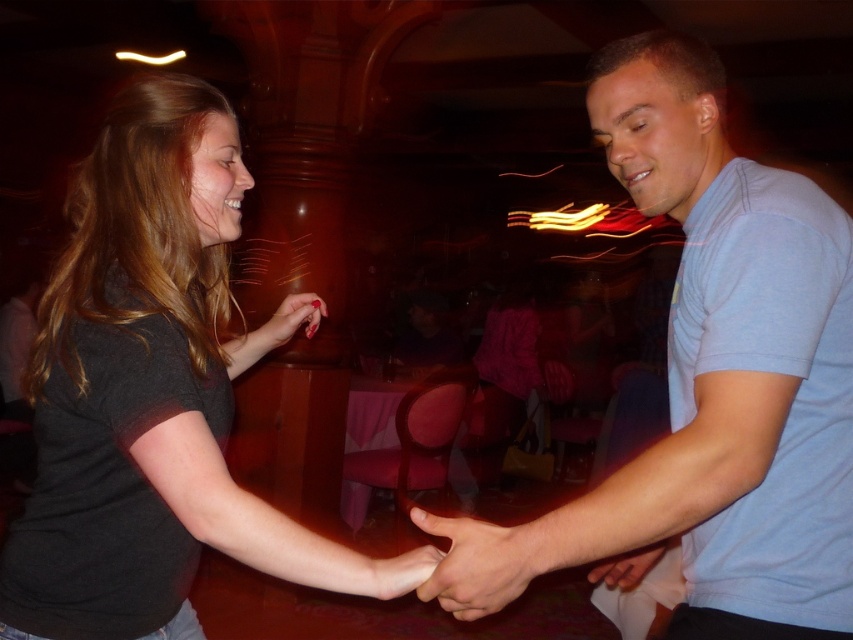
Between light blue cotton shirt at center and smooth red nail polish at center, which one has less height?

smooth red nail polish at center is shorter.

Who is more distant from viewer, (769, 326) or (312, 308)?

The point (312, 308) is behind.

Find the location of a particular element. The height and width of the screenshot is (640, 853). light blue cotton shirt at center is located at coordinates pyautogui.click(x=709, y=384).

The width and height of the screenshot is (853, 640). Identify the location of light blue cotton shirt at center. (709, 384).

Is point (546, 534) more distant than point (289, 328)?

No, (546, 534) is in front of (289, 328).

Find the location of a particular element. The width and height of the screenshot is (853, 640). smooth skin hand at center is located at coordinates (486, 561).

Can you confirm if light blue cotton shirt at center is taller than smooth skin hand at center?

Yes.

Who is positioned more to the right, light blue cotton shirt at center or smooth skin hand at center?

From the viewer's perspective, light blue cotton shirt at center appears more on the right side.

Does point (689, 228) come in front of point (476, 540)?

No, it is behind (476, 540).

Locate an element on the screen. light blue cotton shirt at center is located at coordinates (709, 384).